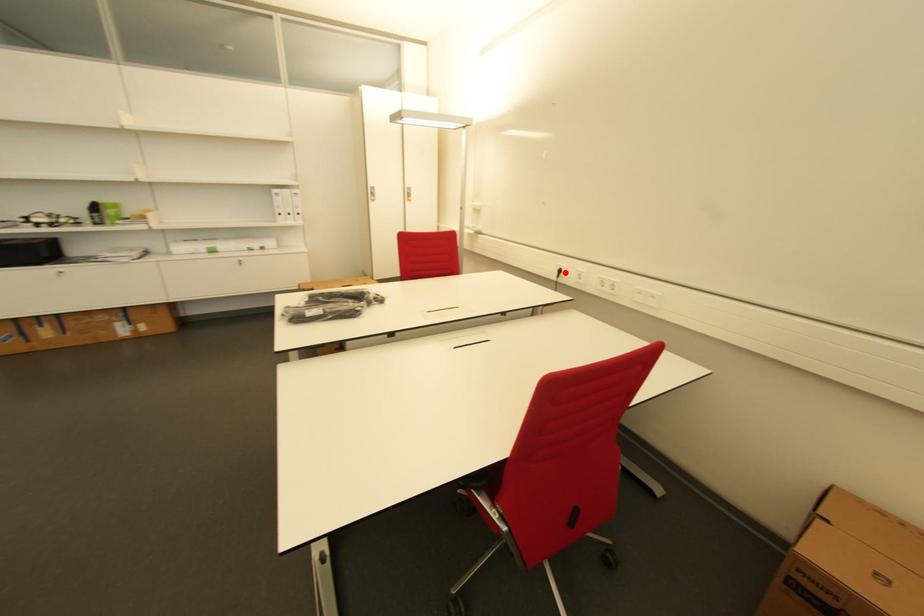
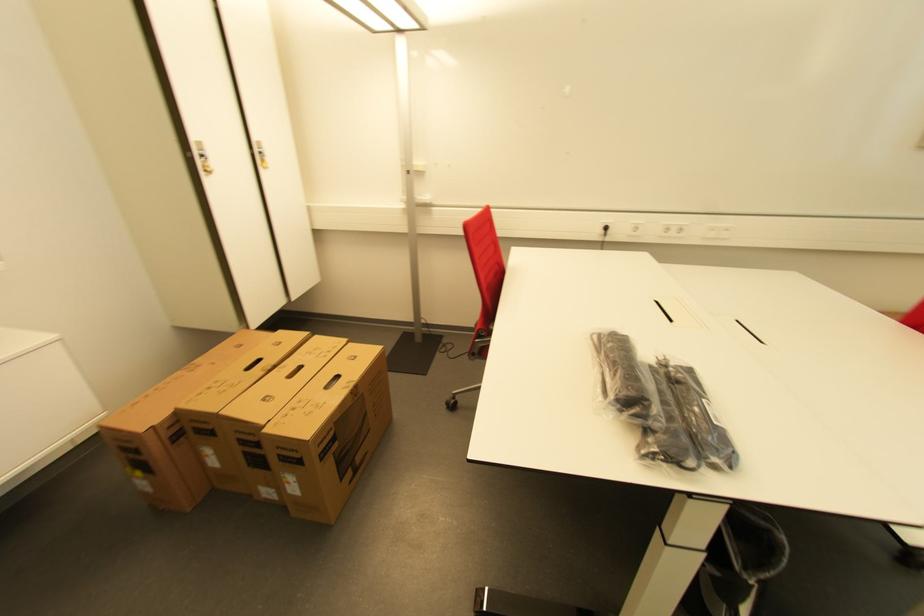
The point at the highlighted location is marked in the first image. Where is the corresponding point in the second image?

(611, 230)